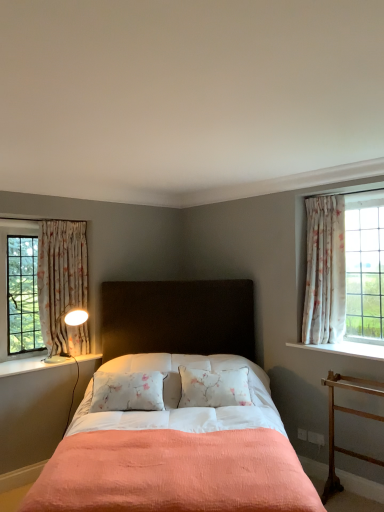
Question: Visually, is matte white table lamp at left positioned to the left or to the right of floral fabric curtain at left, positioned as the 2th curtain in right-to-left order?

Choices:
 (A) left
 (B) right

Answer: (B)

Question: Is matte white table lamp at left taller or shorter than floral fabric curtain at left, marked as the first curtain in a left-to-right arrangement?

Choices:
 (A) tall
 (B) short

Answer: (B)

Question: Based on their relative distances, which object is nearer to the floral fabric curtain at left, positioned as the 2th curtain in right-to-left order?

Choices:
 (A) white painted wood at left, which is the first window sill in left-to-right order
 (B) matte black headboard at center
 (C) wooden at right
 (D) white painted wood at right, which is the second window sill in bottom-to-top order
 (E) matte white table lamp at left

Answer: (E)

Question: Which of these objects is positioned farthest from the white painted wood at left, which is the second window sill in right-to-left order?

Choices:
 (A) floral fabric curtain at left, positioned as the 2th curtain in right-to-left order
 (B) matte black headboard at center
 (C) matte white table lamp at left
 (D) white painted wood at right, which is the 1th window sill from top to bottom
 (E) wooden at right

Answer: (E)